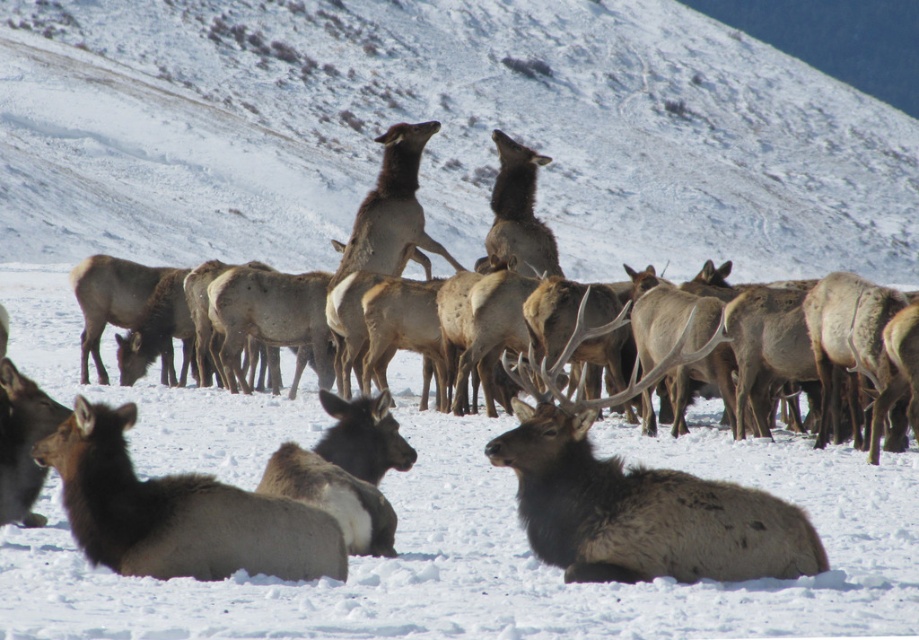
Question: Which object is positioned closest to the snowy white hillside at upper center?

Choices:
 (A) brown velvet antlers at upper center
 (B) brown matte/deer at center
 (C) brown fuzzy deer at lower left

Answer: (A)

Question: Observing the image, what is the correct spatial positioning of brown velvet antlers at upper center in reference to brown fuzzy deer at lower left?

Choices:
 (A) left
 (B) right

Answer: (B)

Question: Which point is closer to the camera taking this photo?

Choices:
 (A) (522, 432)
 (B) (449, 48)
 (C) (305, 260)
 (D) (77, 420)

Answer: (D)

Question: Does snowy white hillside at upper center have a lesser width compared to brown matte/deer at center?

Choices:
 (A) no
 (B) yes

Answer: (A)

Question: Among these objects, which one is nearest to the camera?

Choices:
 (A) snowy white hillside at upper center
 (B) brown fuzzy deer at lower left
 (C) brown matte/deer at center
 (D) brown velvet antlers at upper center

Answer: (D)

Question: Is snowy white hillside at upper center to the right of brown matte/deer at center from the viewer's perspective?

Choices:
 (A) no
 (B) yes

Answer: (A)